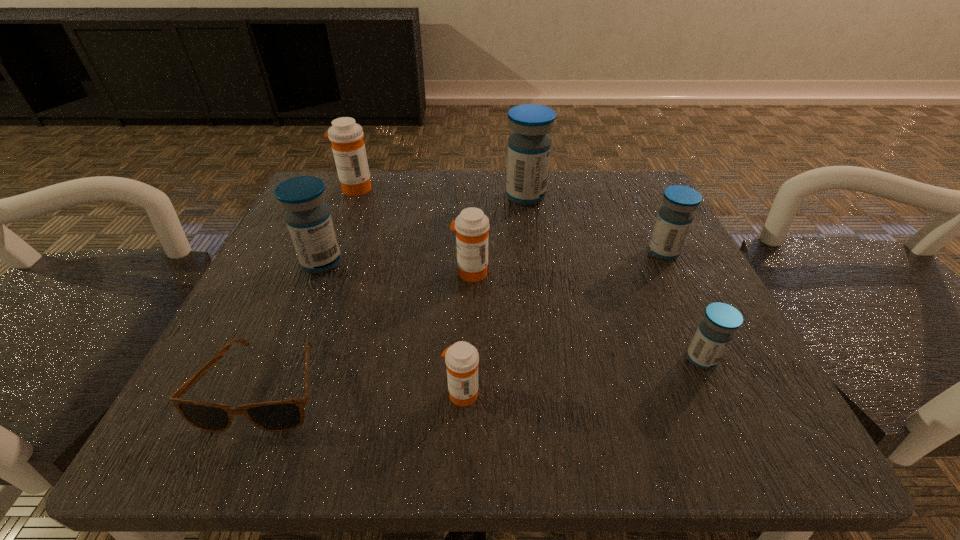
I want to click on the nearest medicine, so click(461, 359).

You are a GUI agent. You are given a task and a screenshot of the screen. Output one action in this format:
    pyautogui.click(x=<x>, y=<y>)
    Task: Click on the sunglasses
    The height and width of the screenshot is (540, 960).
    Given the screenshot: What is the action you would take?
    pyautogui.click(x=283, y=415)

At what (x,y) coordinates should I click in order to perform the action: click on blank space located 0.050m on the left of the tallest medicine. Please return your answer as a coordinate pair (x, y). This screenshot has width=960, height=540. Looking at the image, I should click on (481, 197).

Image resolution: width=960 pixels, height=540 pixels. I want to click on vacant region located on the front of the farthest orange medicine, so click(312, 296).

Find the location of a particular element. Image resolution: width=960 pixels, height=540 pixels. free region located 0.140m on the back of the second biggest blue medicine is located at coordinates (345, 207).

Locate an element on the screen. The width and height of the screenshot is (960, 540). vacant area situated 0.240m on the back of the third biggest blue medicine is located at coordinates (627, 177).

Locate an element on the screen. The width and height of the screenshot is (960, 540). vacant space positioned on the back of the second smallest orange medicine is located at coordinates (472, 203).

Where is `blank space located 0.160m on the left of the smallest blue medicine`? The width and height of the screenshot is (960, 540). blank space located 0.160m on the left of the smallest blue medicine is located at coordinates (571, 359).

This screenshot has height=540, width=960. I want to click on blank area located on the back of the nearest orange medicine, so click(467, 254).

Image resolution: width=960 pixels, height=540 pixels. In order to click on medicine at the near edge in this screenshot , I will do `click(461, 359)`.